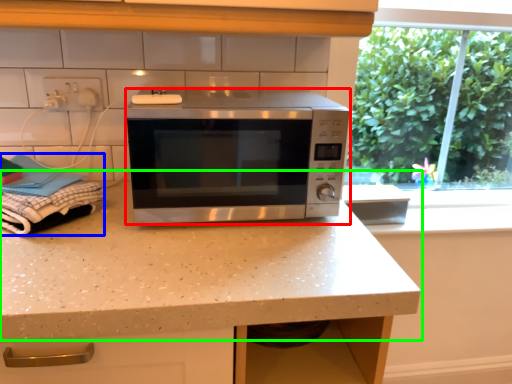
Question: Which object is positioned farthest from microwave oven (highlighted by a red box)? Select from laundry (highlighted by a blue box) and countertop (highlighted by a green box).

Choices:
 (A) laundry
 (B) countertop

Answer: (A)